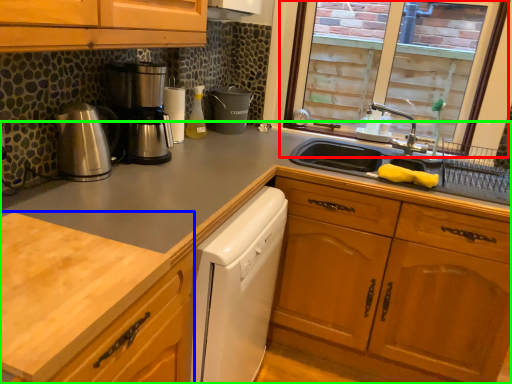
Question: Which is farther away from window (highlighted by a red box)? countertop (highlighted by a blue box) or cabinetry (highlighted by a green box)?

Choices:
 (A) countertop
 (B) cabinetry

Answer: (A)